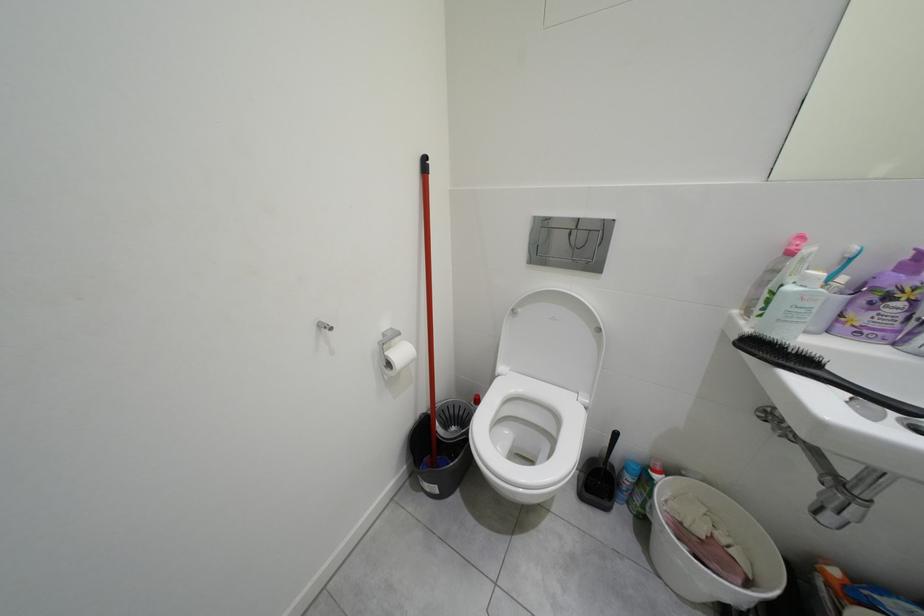
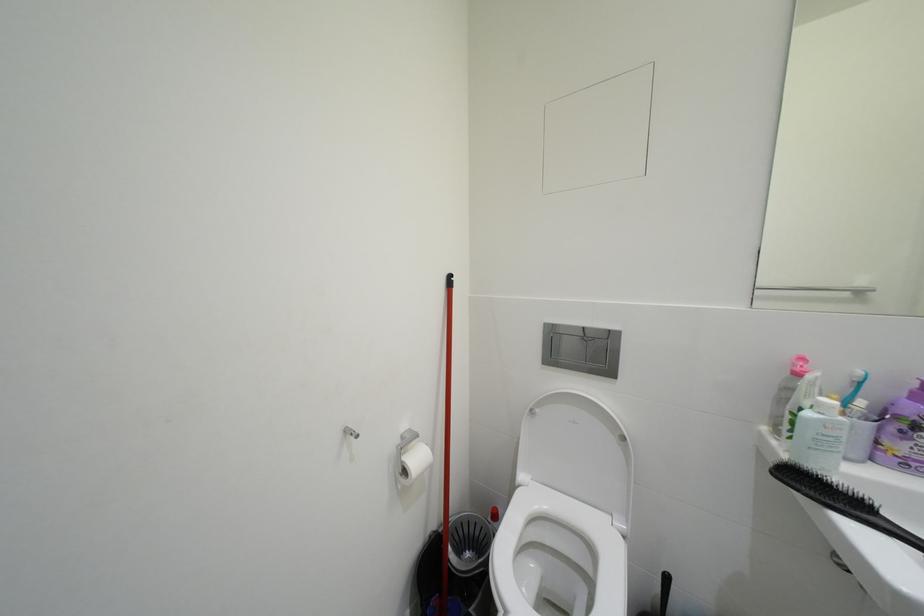
Question: How did the camera likely rotate?

Choices:
 (A) Left
 (B) Right
 (C) Up
 (D) Down

Answer: (C)